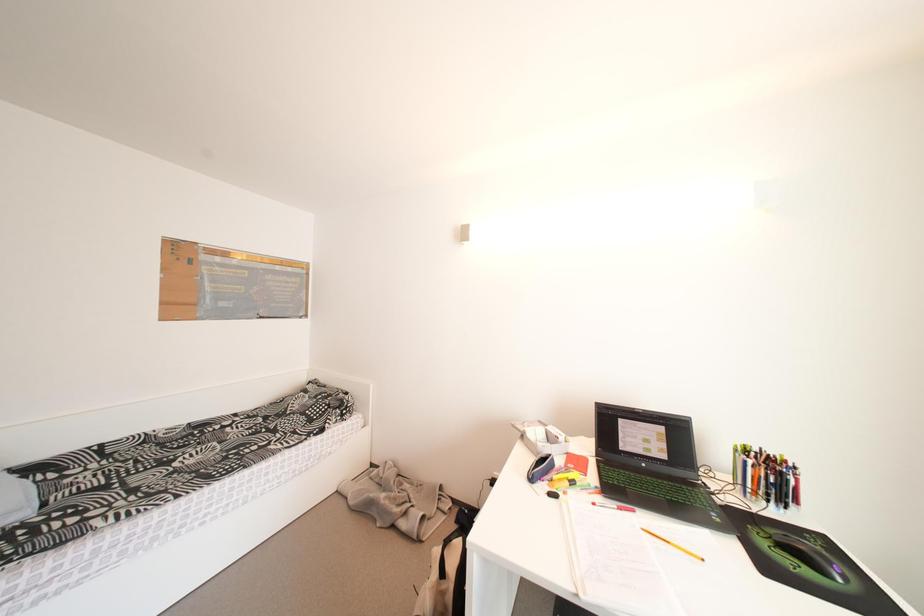
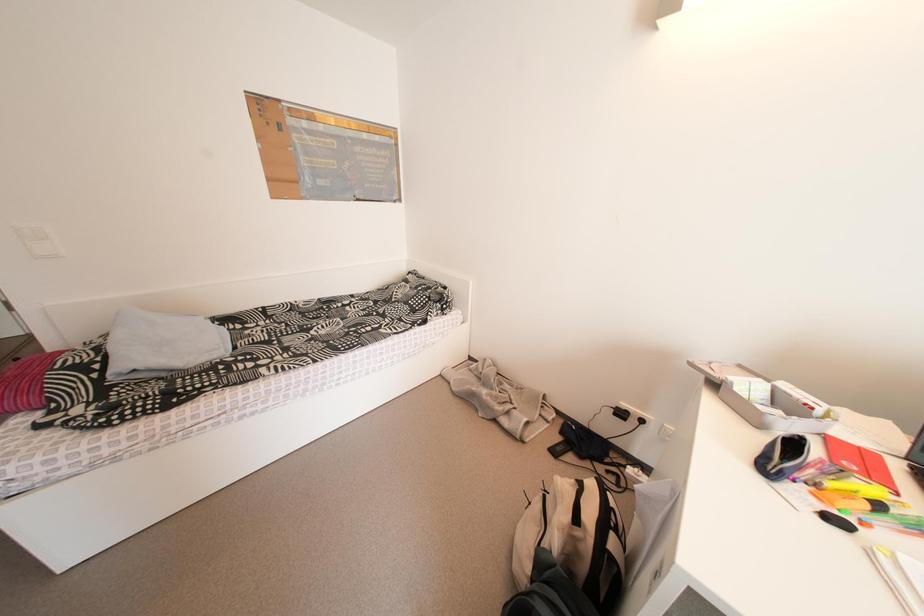
Consider the image. The images are taken continuously from a first-person perspective. In which direction are you moving?

The cameraman walked toward left, forward.